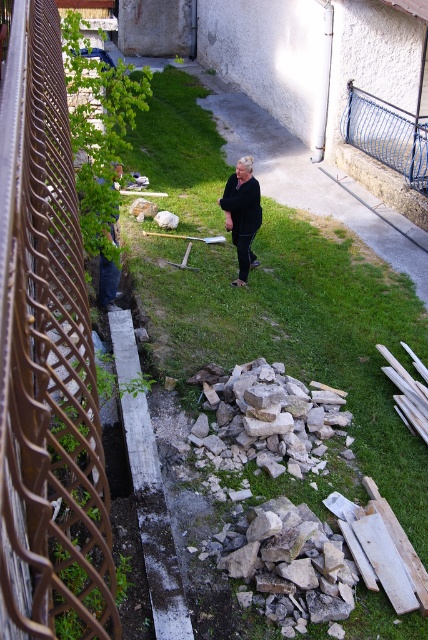
You are a construction worker who needs to place a new sign at point A and point B. The coordinates for point A are point [262,364] and point B are point [98,301]. If you want to place the sign closer to the woman standing near the center right, which point should you choose?

Point A at [262,364] is closer to the woman standing near the center right because it is positioned in front of point B at [98,301], which is further away from her location.

You are a delivery person trying to navigate through the construction site. You need to place a heavy box on the gray rough stone at center without stepping on the dark blue jeans at lower left. Is this possible based on their positions?

The gray rough stone at center is in front of the dark blue jeans at lower left, so you can place the box on the gray rough stone at center without stepping on the dark blue jeans at lower left as they are positioned behind it.